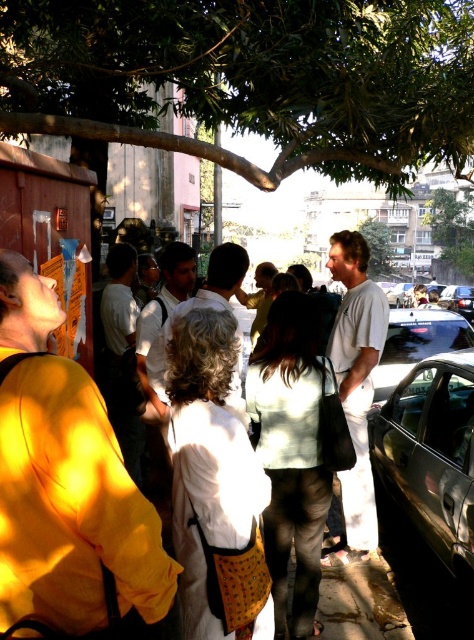
Question: Can you confirm if shiny black car at center is thinner than green leafy tree at upper right?

Choices:
 (A) no
 (B) yes

Answer: (B)

Question: Is the position of shiny black car at center more distant than that of metallic silver car at center?

Choices:
 (A) no
 (B) yes

Answer: (A)

Question: Which object is positioned farthest from the shiny black car at right?

Choices:
 (A) white cotton shirt at center
 (B) green leafy tree at upper right
 (C) metallic silver car at center

Answer: (B)

Question: Estimate the real-world distances between objects in this image. Which object is farther from the green leafy tree at upper center?

Choices:
 (A) white cotton shirt at center
 (B) green leafy tree at upper right
 (C) shiny black car at center

Answer: (B)

Question: Among these points, which one is farthest from the camera?

Choices:
 (A) (352, 435)
 (B) (462, 134)
 (C) (419, 337)

Answer: (C)

Question: Can you confirm if green leafy tree at upper center is positioned to the left of metallic silver car at center?

Choices:
 (A) yes
 (B) no

Answer: (A)